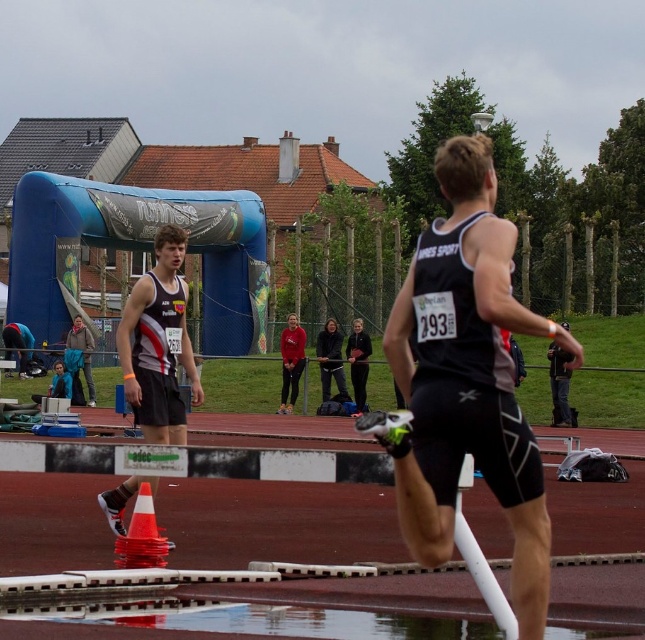
You are a photographer standing at the camera position capturing this track and field event. You want to place a marker at point (459, 156) to mark the finish line. How far in feet should you place the marker from your current position?

The distance of point (459, 156) from camera is 19.22 feet, so you should place the marker 19.22 feet away from your current position.

You are a photographer at the track event. You need to capture a photo where both the matte black singlet at center and the matte red hoodie at center are clearly visible. Given their sizes, which one might appear closer to the camera in the final image?

The matte black singlet at center is bigger than the matte red hoodie at center, so it would appear closer to the camera in the final image because larger objects in a photo typically indicate they are nearer to the viewer.